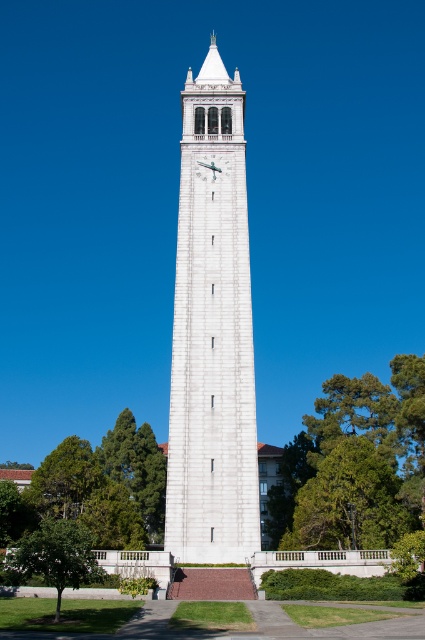
Question: Considering the real-world distances, which object is closest to the green leafy tree at lower left?

Choices:
 (A) green leafy tree at center
 (B) white stone clock at center
 (C) white stone clock tower at center

Answer: (C)

Question: Which point is farther from the camera taking this photo?

Choices:
 (A) (214, 176)
 (B) (53, 620)

Answer: (A)

Question: Can you confirm if white stone clock tower at center is bigger than white stone clock at center?

Choices:
 (A) no
 (B) yes

Answer: (B)

Question: Among these objects, which one is nearest to the camera?

Choices:
 (A) green leafy tree at center
 (B) white stone clock at center
 (C) green leafy tree at lower left

Answer: (C)

Question: Does white stone clock tower at center appear on the right side of green leafy tree at lower left?

Choices:
 (A) no
 (B) yes

Answer: (B)

Question: Can you confirm if white stone clock tower at center is positioned to the right of green leafy tree at lower left?

Choices:
 (A) yes
 (B) no

Answer: (A)